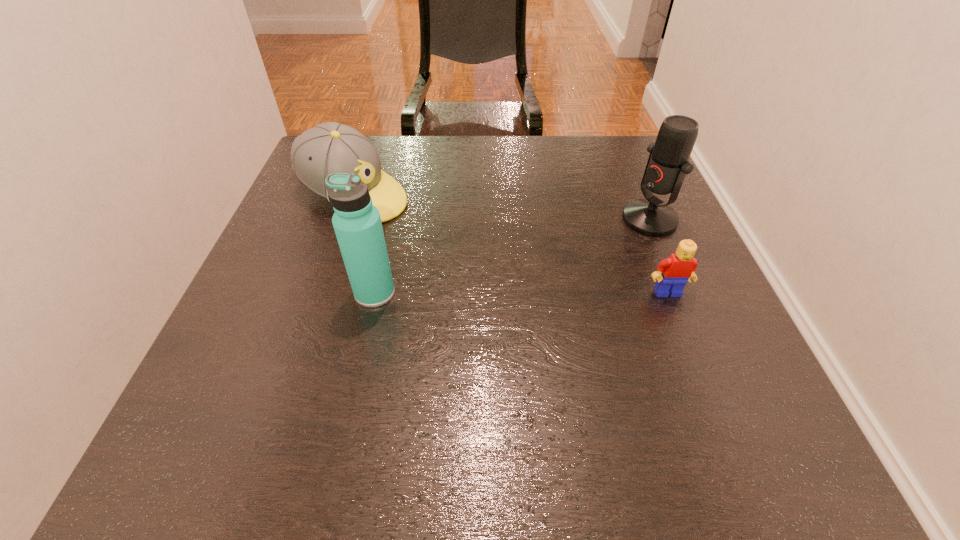
In order to click on free spot located 0.290m on the side of the microphone with the red ring in this screenshot , I will do `click(525, 276)`.

This screenshot has height=540, width=960. Identify the location of blank space located 0.080m on the side of the microphone with the red ring. (603, 240).

Locate an element on the screen. The height and width of the screenshot is (540, 960). object that is at the far edge is located at coordinates (330, 147).

The image size is (960, 540). I want to click on object that is at the left edge, so click(330, 147).

You are a GUI agent. You are given a task and a screenshot of the screen. Output one action in this format:
    pyautogui.click(x=<x>, y=<y>)
    Task: Click on the Lego that is at the right edge
    The image size is (960, 540).
    Given the screenshot: What is the action you would take?
    pyautogui.click(x=678, y=268)

Locate an element on the screen. The image size is (960, 540). microphone at the right edge is located at coordinates (668, 163).

The image size is (960, 540). I want to click on object located in the far left corner section of the desktop, so click(330, 147).

In the image, there is a desktop. Where is `vacant space at the far edge`? vacant space at the far edge is located at coordinates [x=443, y=147].

The height and width of the screenshot is (540, 960). Find the location of `vacant space at the near edge of the desktop`. vacant space at the near edge of the desktop is located at coordinates (380, 406).

This screenshot has height=540, width=960. In the image, there is a desktop. In order to click on vacant space at the left edge in this screenshot , I will do 300,331.